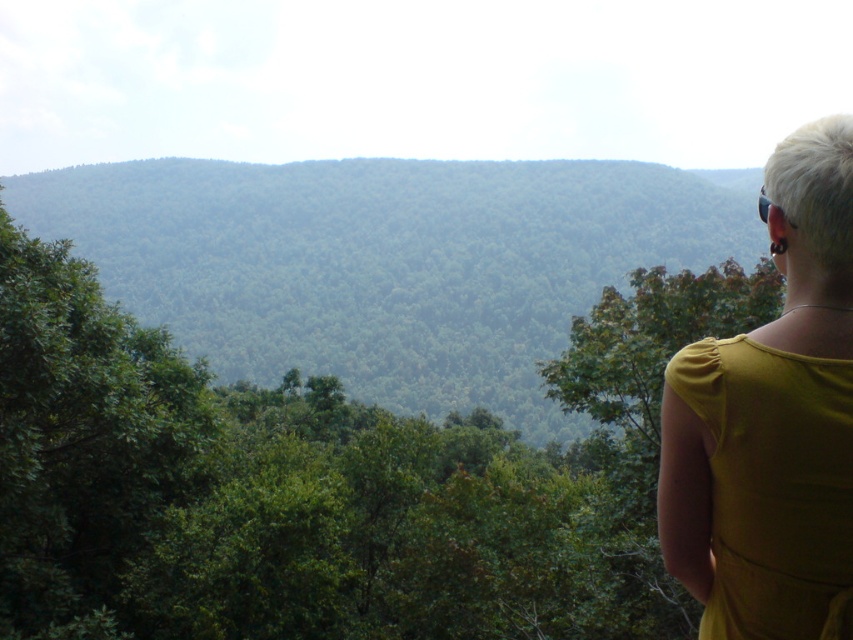
Does green leafy tree at upper right appear on the right side of green leafy tree at right?

No, green leafy tree at upper right is not to the right of green leafy tree at right.

This screenshot has height=640, width=853. Describe the element at coordinates (350, 396) in the screenshot. I see `green leafy tree at upper right` at that location.

Identify the location of green leafy tree at upper right. The height and width of the screenshot is (640, 853). (350, 396).

Identify the location of mustard yellow dress at right. (x=770, y=420).

Can you confirm if mustard yellow dress at right is positioned below green leafy tree at right?

No, mustard yellow dress at right is not below green leafy tree at right.

Describe the element at coordinates (770, 420) in the screenshot. I see `mustard yellow dress at right` at that location.

Locate an element on the screen. This screenshot has height=640, width=853. mustard yellow dress at right is located at coordinates (770, 420).

Does green leafy tree at upper right appear over mustard yellow dress at right?

Yes.

Measure the distance between green leafy tree at upper right and camera.

The distance of green leafy tree at upper right from camera is 31.57 feet.

This screenshot has height=640, width=853. Identify the location of green leafy tree at upper right. (350, 396).